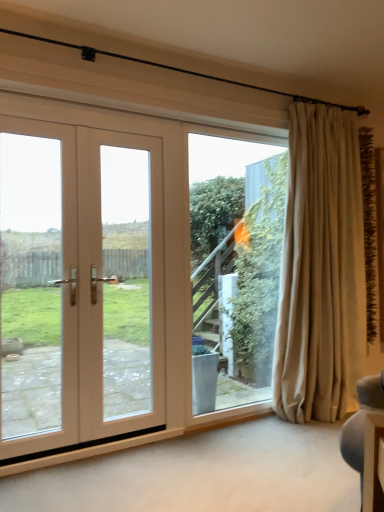
Question: Is beige fabric curtain at right placed right next to transparent glass window at center?

Choices:
 (A) no
 (B) yes

Answer: (A)

Question: Is beige fabric curtain at right oriented away from transparent glass window at center?

Choices:
 (A) yes
 (B) no

Answer: (B)

Question: Considering the relative positions of beige fabric curtain at right and transparent glass window at center in the image provided, is beige fabric curtain at right to the right of transparent glass window at center from the viewer's perspective?

Choices:
 (A) yes
 (B) no

Answer: (A)

Question: From a real-world perspective, is beige fabric curtain at right positioned under transparent glass window at center based on gravity?

Choices:
 (A) yes
 (B) no

Answer: (B)

Question: From the image's perspective, does beige fabric curtain at right appear higher than transparent glass window at center?

Choices:
 (A) yes
 (B) no

Answer: (A)

Question: From the image's perspective, is white wood door at left positioned above or below beige fabric curtain at right?

Choices:
 (A) below
 (B) above

Answer: (A)

Question: In the image, is white wood door at left on the left side or the right side of beige fabric curtain at right?

Choices:
 (A) left
 (B) right

Answer: (A)

Question: From their relative heights in the image, would you say white wood door at left is taller or shorter than beige fabric curtain at right?

Choices:
 (A) tall
 (B) short

Answer: (B)

Question: Is white wood door at left bigger or smaller than beige fabric curtain at right?

Choices:
 (A) big
 (B) small

Answer: (B)

Question: Is beige fabric curtain at right in front of or behind transparent glass window at center in the image?

Choices:
 (A) behind
 (B) front

Answer: (B)

Question: Does point (334, 384) appear closer or farther from the camera than point (226, 189)?

Choices:
 (A) farther
 (B) closer

Answer: (B)

Question: Visually, is beige fabric curtain at right positioned to the left or to the right of transparent glass window at center?

Choices:
 (A) right
 (B) left

Answer: (A)

Question: In terms of width, does beige fabric curtain at right look wider or thinner when compared to transparent glass window at center?

Choices:
 (A) thin
 (B) wide

Answer: (B)

Question: From a real-world perspective, is transparent glass window at center positioned above or below white wood door at left?

Choices:
 (A) above
 (B) below

Answer: (B)

Question: In terms of size, does transparent glass window at center appear bigger or smaller than white wood door at left?

Choices:
 (A) big
 (B) small

Answer: (B)